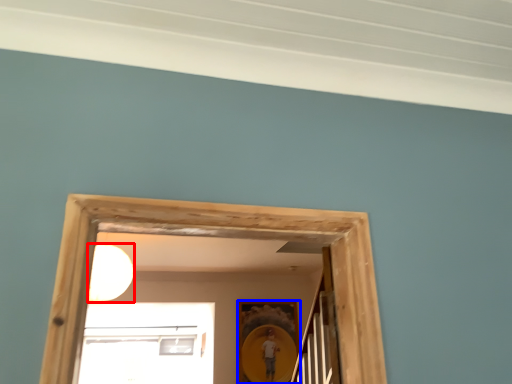
Question: Which of the following is the closest to the observer, light (highlighted by a red box) or picture frame (highlighted by a blue box)?

Choices:
 (A) light
 (B) picture frame

Answer: (A)